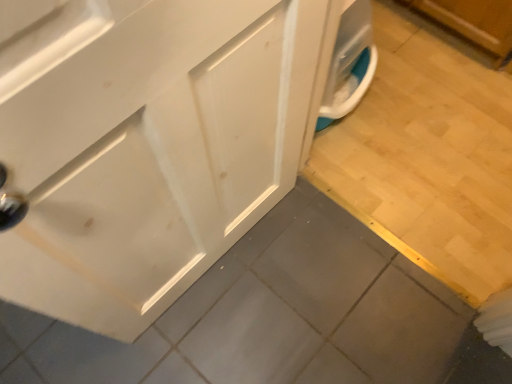
Question: Would you say white glossy cabinet at center contains wooden tile at lower right?

Choices:
 (A) yes
 (B) no

Answer: (B)

Question: Considering the relative sizes of white glossy cabinet at center and wooden tile at lower right in the image provided, is white glossy cabinet at center smaller than wooden tile at lower right?

Choices:
 (A) yes
 (B) no

Answer: (B)

Question: From a real-world perspective, is white glossy cabinet at center on wooden tile at lower right?

Choices:
 (A) no
 (B) yes

Answer: (B)

Question: Is white glossy cabinet at center not within wooden tile at lower right?

Choices:
 (A) no
 (B) yes

Answer: (B)

Question: From the image's perspective, would you say white glossy cabinet at center is shown under wooden tile at lower right?

Choices:
 (A) yes
 (B) no

Answer: (A)

Question: Is white glossy cabinet at center not close to wooden tile at lower right?

Choices:
 (A) yes
 (B) no

Answer: (B)

Question: Is wooden tile at lower right looking in the opposite direction of white glossy cabinet at center?

Choices:
 (A) yes
 (B) no

Answer: (B)

Question: Does wooden tile at lower right appear on the right side of white glossy cabinet at center?

Choices:
 (A) no
 (B) yes

Answer: (B)

Question: Could you tell me if wooden tile at lower right is turned towards white glossy cabinet at center?

Choices:
 (A) yes
 (B) no

Answer: (B)

Question: From the image's perspective, is wooden tile at lower right over white glossy cabinet at center?

Choices:
 (A) no
 (B) yes

Answer: (B)

Question: Would you consider wooden tile at lower right to be distant from white glossy cabinet at center?

Choices:
 (A) yes
 (B) no

Answer: (B)

Question: Is wooden tile at lower right positioned beyond the bounds of white glossy cabinet at center?

Choices:
 (A) yes
 (B) no

Answer: (A)

Question: Looking at their shapes, would you say white glossy cabinet at center is wider or thinner than wooden tile at lower right?

Choices:
 (A) wide
 (B) thin

Answer: (B)